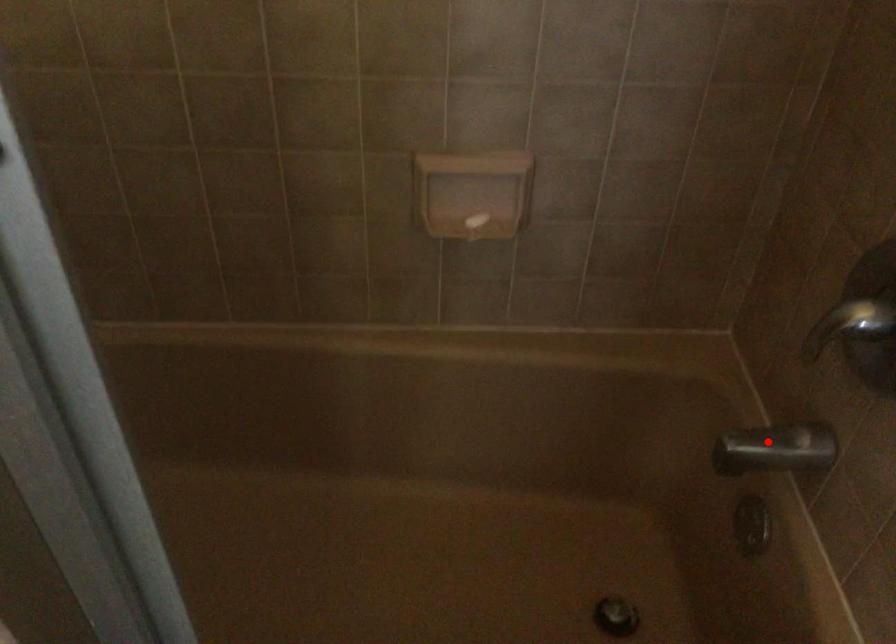
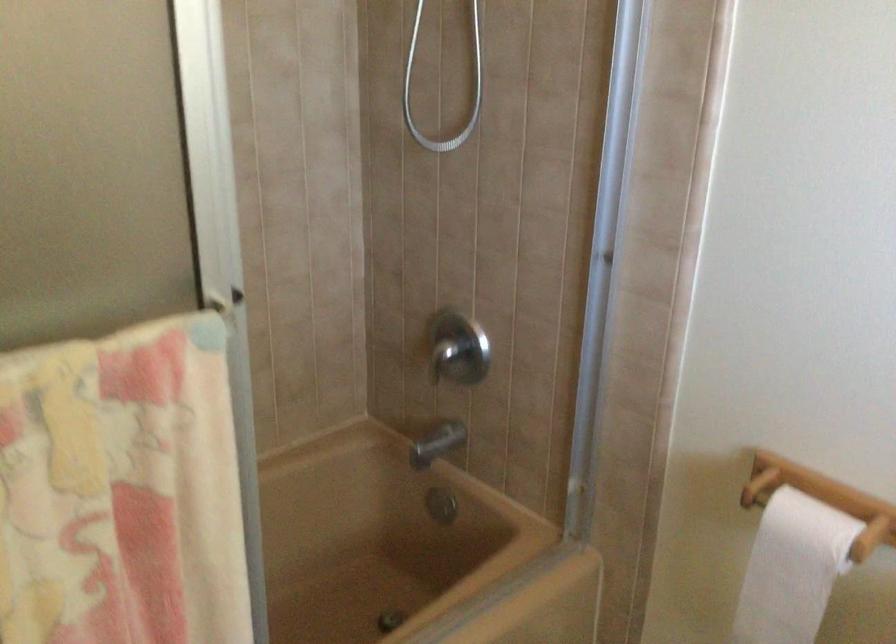
Locate, in the second image, the point that corresponds to the highlighted location in the first image.

(436, 444)